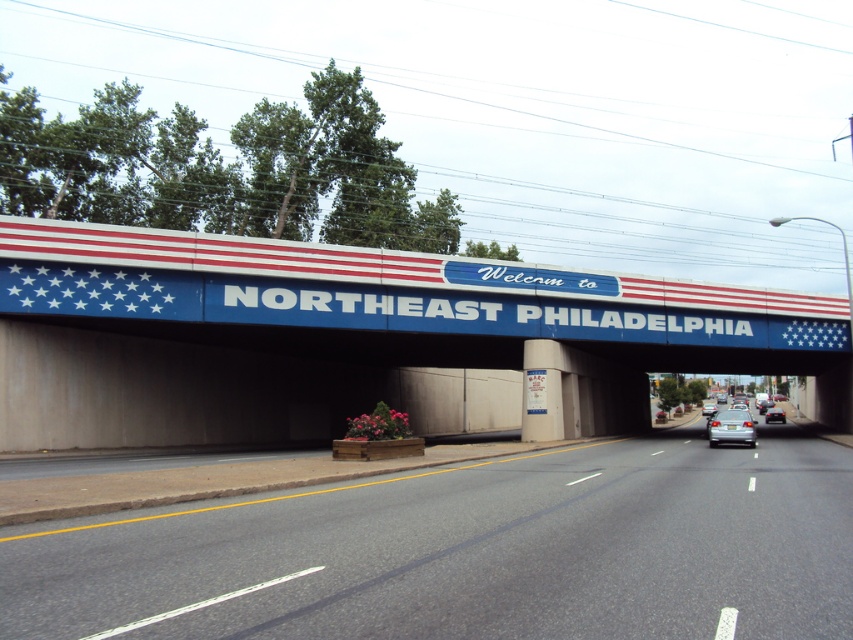
You are standing at the point marked by the coordinate point (730, 428). Looking around, you see the silver metallic sedan at center right. Which direction should you face to see the flower planter box with pink flowers on the left side of the image?

You should face to the left side of the image because the flower planter box with pink flowers is on the left side, while the silver metallic sedan at center right is at your current position marked by point (730, 428).